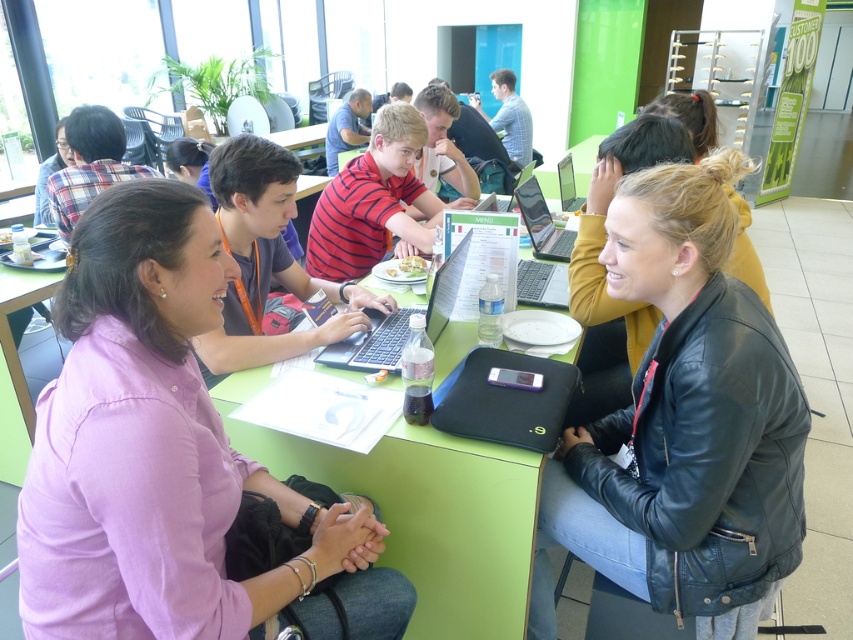
Question: Is shiny silver laptop at center above silver metallic laptop at center?

Choices:
 (A) yes
 (B) no

Answer: (B)

Question: Which point is farther to the camera?

Choices:
 (A) silver metallic laptop at center
 (B) black matte laptop at center
 (C) green matte table at center
 (D) green plastic table at lower left

Answer: (A)

Question: Can you confirm if shiny silver laptop at center is positioned to the left of silver metallic laptop at center?

Choices:
 (A) yes
 (B) no

Answer: (A)

Question: Does black leather jacket at center lie behind black matte laptop at center?

Choices:
 (A) yes
 (B) no

Answer: (B)

Question: Which of the following is the farthest from the observer?

Choices:
 (A) (563, 172)
 (B) (494, 499)
 (C) (532, 188)
 (D) (30, 556)

Answer: (A)

Question: Which point appears closest to the camera in this image?

Choices:
 (A) (563, 204)
 (B) (103, 330)
 (C) (538, 198)
 (D) (683, 308)

Answer: (B)